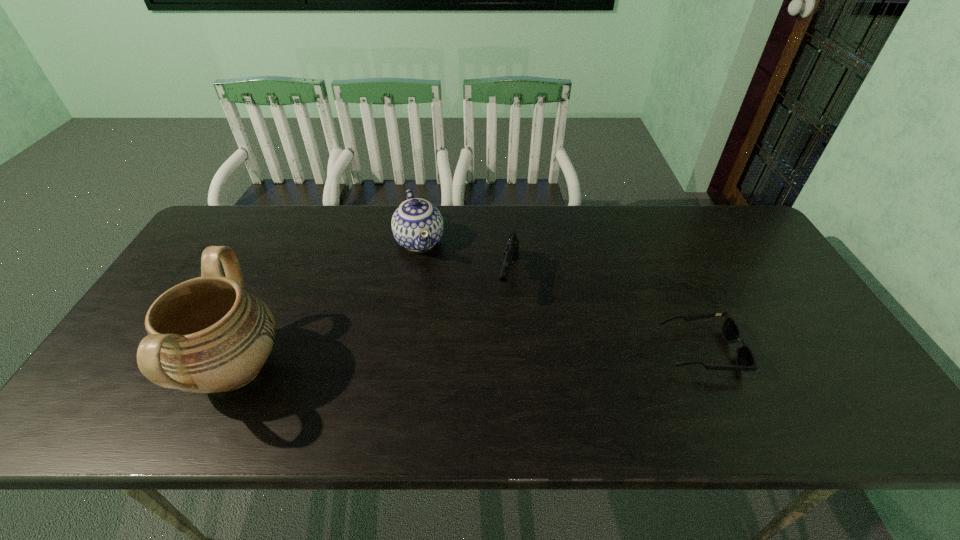
Identify the location of free region at the far edge of the desktop. This screenshot has width=960, height=540. (340, 217).

Where is `free space at the near edge of the desktop`? free space at the near edge of the desktop is located at coordinates (262, 375).

Find the location of a particular element. vacant space at the left edge of the desktop is located at coordinates (130, 354).

Where is `vacant space at the far left corner of the desktop`? vacant space at the far left corner of the desktop is located at coordinates point(218,231).

The height and width of the screenshot is (540, 960). I want to click on free location at the near right corner, so click(x=785, y=368).

The image size is (960, 540). Find the location of `free space between the third tallest object and the chinaware`. free space between the third tallest object and the chinaware is located at coordinates (465, 259).

Identify the location of free space between the second object from right to left and the sunglasses. The height and width of the screenshot is (540, 960). (605, 314).

Identify the location of vacant space that is in between the shortest object and the gun. (605, 314).

Image resolution: width=960 pixels, height=540 pixels. Identify the location of unoccupied area between the leftmost object and the shortest object. (468, 360).

Where is `free space between the second object from right to left and the urn`? The height and width of the screenshot is (540, 960). free space between the second object from right to left and the urn is located at coordinates (372, 323).